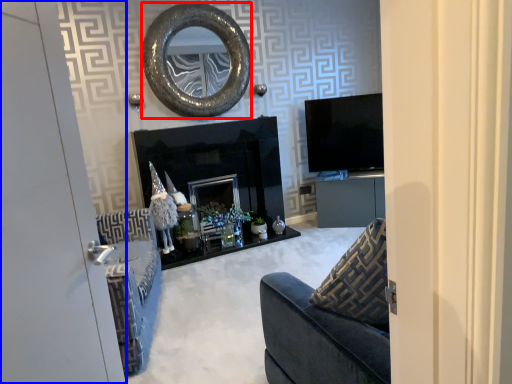
Question: Among these objects, which one is farthest to the camera, oval (highlighted by a red box) or door (highlighted by a blue box)?

Choices:
 (A) oval
 (B) door

Answer: (A)